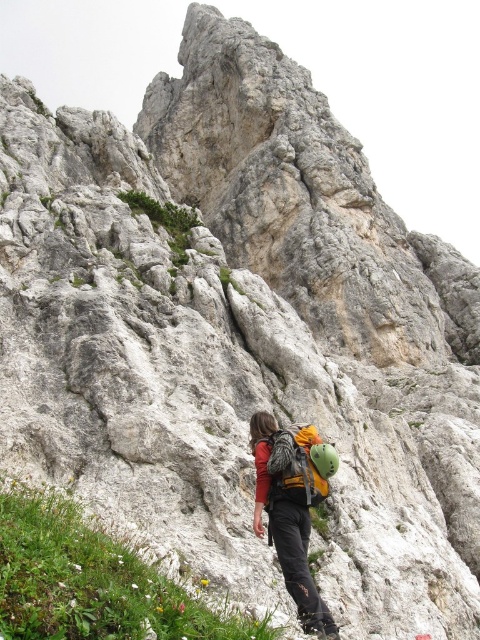
Question: Estimate the real-world distances between objects in this image. Which object is closer to the matte green backpack at center?

Choices:
 (A) matte black backpack at center
 (B) green grass at lower left

Answer: (A)

Question: Estimate the real-world distances between objects in this image. Which object is farther from the green grass at lower left?

Choices:
 (A) matte black backpack at center
 (B) matte green backpack at center

Answer: (B)

Question: Does matte black backpack at center appear on the left side of matte green backpack at center?

Choices:
 (A) no
 (B) yes

Answer: (B)

Question: Does green grass at lower left have a lesser width compared to matte green backpack at center?

Choices:
 (A) yes
 (B) no

Answer: (B)

Question: Where is green grass at lower left located in relation to matte green backpack at center in the image?

Choices:
 (A) left
 (B) right

Answer: (A)

Question: Which object is positioned closest to the matte black backpack at center?

Choices:
 (A) green grass at lower left
 (B) matte green backpack at center

Answer: (B)